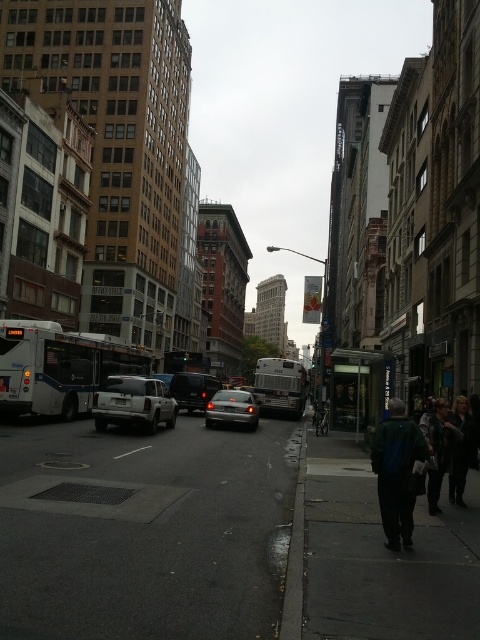
Question: Which point is closer to the camera taking this photo?

Choices:
 (A) (384, 468)
 (B) (191, 392)
 (C) (98, 554)
 (D) (455, 484)

Answer: (C)

Question: Which of the following is the farthest from the observer?

Choices:
 (A) gray asphalt at lower left
 (B) silver metallic sedan at center
 (C) white matte suv at center
 (D) dark brown leather jacket at lower right

Answer: (B)

Question: Can you confirm if white matte bus at left is positioned above shiny black sedan at center?

Choices:
 (A) no
 (B) yes

Answer: (B)

Question: Which object is the closest to the white matte bus at left?

Choices:
 (A) silver metallic sedan at center
 (B) white matte suv at center

Answer: (B)

Question: Does dark asphalt sidewalk at lower right have a greater width compared to dark green jacket at lower right?

Choices:
 (A) yes
 (B) no

Answer: (A)

Question: Observing the image, what is the correct spatial positioning of dark asphalt sidewalk at lower right in reference to green fabric jacket at lower right?

Choices:
 (A) right
 (B) left

Answer: (A)